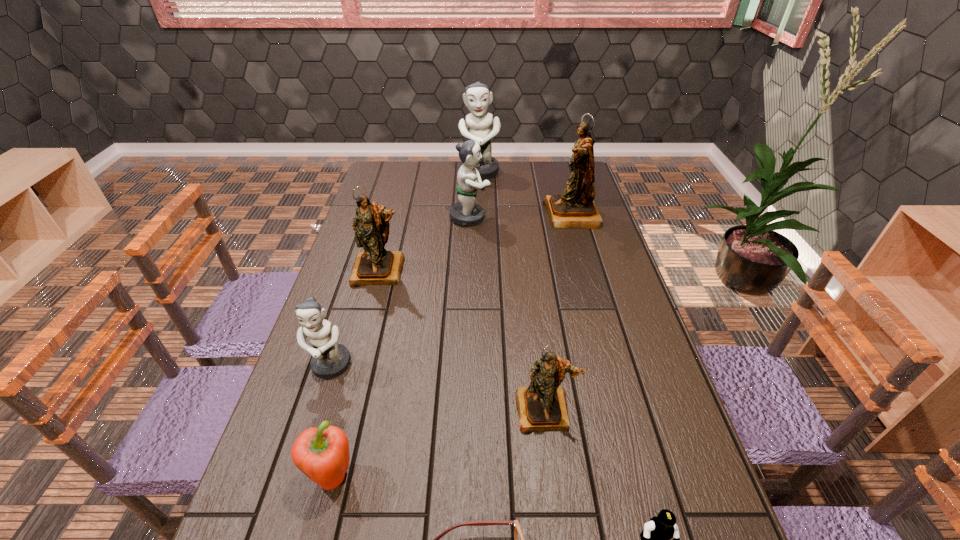
Where is `vacant space in between the farthest gold figurine and the second smallest green figurine`? This screenshot has width=960, height=540. vacant space in between the farthest gold figurine and the second smallest green figurine is located at coordinates (521, 216).

This screenshot has width=960, height=540. Identify the location of free space between the smallest green figurine and the pepper. (331, 422).

The height and width of the screenshot is (540, 960). I want to click on free space between the nearest green figurine and the biggest gold figurine, so click(x=451, y=291).

Locate an element on the screen. This screenshot has width=960, height=540. free space that is in between the sixth farthest object and the second nearest gold figurine is located at coordinates [463, 341].

At what (x,y) coordinates should I click in order to perform the action: click on free space that is in between the second farthest green figurine and the rightmost figurine. Please return your answer as a coordinate pair (x, y). The width and height of the screenshot is (960, 540). Looking at the image, I should click on (521, 216).

The image size is (960, 540). I want to click on vacant area between the second gold figurine from right to left and the fifth nearest object, so click(x=438, y=388).

Choose which object is the nearest neighbor to the orange pepper. Please provide its 2D coordinates. Your answer should be formatted as a tuple, i.e. [(x, y)], where the tuple contains the x and y coordinates of a point satisfying the conditions above.

[(518, 536)]

You are a GUI agent. You are given a task and a screenshot of the screen. Output one action in this format:
    pyautogui.click(x=<x>, y=<y>)
    Task: Click on the object identified as the second closest to the second smallest green figurine
    
    Given the screenshot: What is the action you would take?
    pyautogui.click(x=375, y=266)

This screenshot has height=540, width=960. I want to click on figurine that is the fifth closest to the orange pepper, so click(575, 208).

Select which figurine appears as the fourth closest to the biggest gold figurine. Please provide its 2D coordinates. Your answer should be formatted as a tuple, i.e. [(x, y)], where the tuple contains the x and y coordinates of a point satisfying the conditions above.

[(542, 406)]